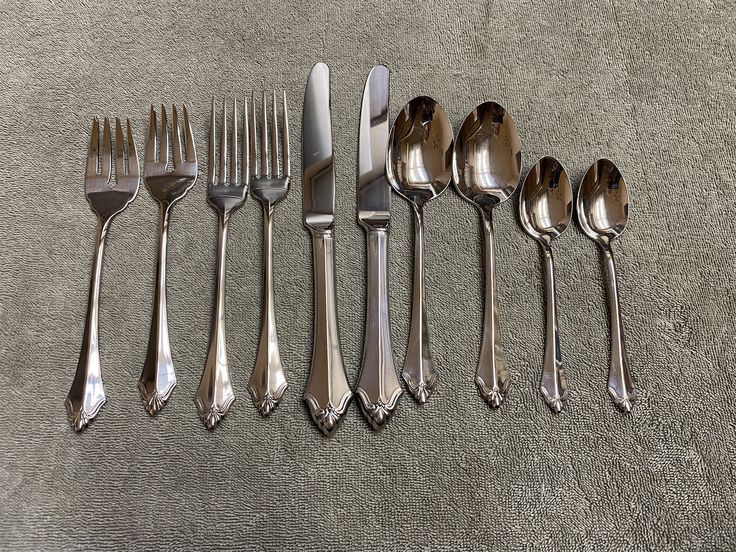
Where is `spoons`? The width and height of the screenshot is (736, 552). spoons is located at coordinates (417, 238), (489, 259), (553, 273), (618, 288).